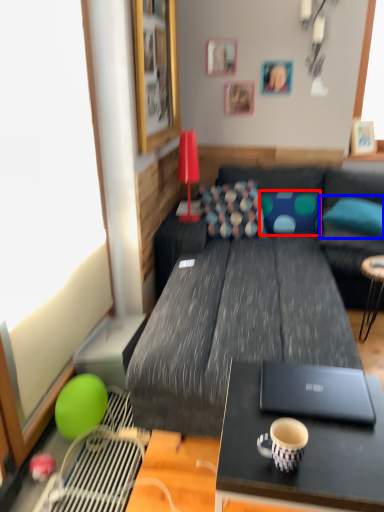
Question: Which object is further to the camera taking this photo, pillow (highlighted by a red box) or pillow (highlighted by a blue box)?

Choices:
 (A) pillow
 (B) pillow

Answer: (A)